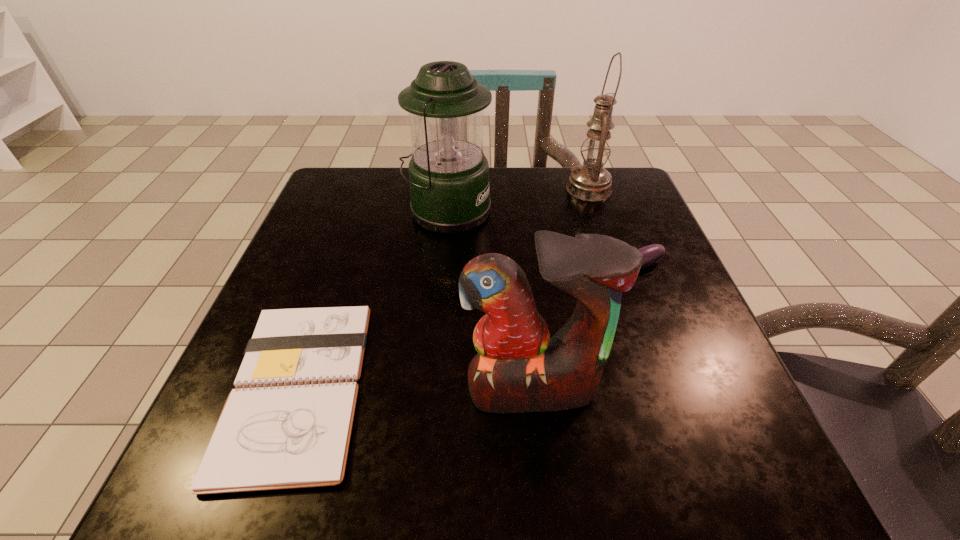
You are a GUI agent. You are given a task and a screenshot of the screen. Output one action in this format:
    pyautogui.click(x=<x>, y=<y>)
    Task: Click on the blank area at the near edge
    The height and width of the screenshot is (540, 960).
    Given the screenshot: What is the action you would take?
    pyautogui.click(x=477, y=498)

In the image, there is a desktop. Where is `vacant space at the left edge`? vacant space at the left edge is located at coordinates (326, 284).

You are a GUI agent. You are given a task and a screenshot of the screen. Output one action in this format:
    pyautogui.click(x=<x>, y=<y>)
    Task: Click on the free space at the right edge
    The image size is (960, 540).
    Given the screenshot: What is the action you would take?
    pyautogui.click(x=631, y=301)

I want to click on vacant region at the far left corner of the desktop, so click(360, 184).

Locate an element on the screen. The image size is (960, 540). vacant area at the far right corner is located at coordinates (606, 208).

Locate an element on the screen. Image resolution: width=960 pixels, height=540 pixels. vacant space at the near right corner of the desktop is located at coordinates (744, 461).

Identify the location of free area in between the second shortest object and the notepad. (461, 329).

At what (x,y) coordinates should I click in order to perform the action: click on empty space that is in between the notepad and the second shortest object. Please return your answer as a coordinate pair (x, y). Looking at the image, I should click on (461, 329).

At what (x,y) coordinates should I click in order to perform the action: click on vacant area that lies between the shortest object and the parrot. Please return your answer as a coordinate pair (x, y). Looking at the image, I should click on (415, 388).

Find the location of a particular element. This screenshot has width=960, height=540. vacant space in between the oil lamp and the lantern is located at coordinates (518, 200).